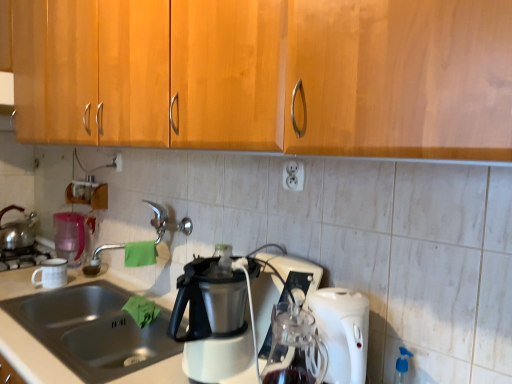
Question: Considering the relative sizes of shiny metallic kettle at left and white matte coffee cup at left in the image provided, is shiny metallic kettle at left smaller than white matte coffee cup at left?

Choices:
 (A) no
 (B) yes

Answer: (A)

Question: Does shiny metallic kettle at left have a greater width compared to white matte coffee cup at left?

Choices:
 (A) no
 (B) yes

Answer: (B)

Question: Is shiny metallic kettle at left thinner than white matte coffee cup at left?

Choices:
 (A) yes
 (B) no

Answer: (B)

Question: Is shiny metallic kettle at left located outside white matte coffee cup at left?

Choices:
 (A) yes
 (B) no

Answer: (A)

Question: Does shiny metallic kettle at left come in front of white matte coffee cup at left?

Choices:
 (A) yes
 (B) no

Answer: (B)

Question: Is blue translucent spray bottle at lower right wider or thinner than white plastic electric outlet at upper center, marked as the second electric outlet in a front-to-back arrangement?

Choices:
 (A) wide
 (B) thin

Answer: (A)

Question: Is blue translucent spray bottle at lower right taller or shorter than white plastic electric outlet at upper center, marked as the first electric outlet in a top-to-bottom arrangement?

Choices:
 (A) tall
 (B) short

Answer: (A)

Question: Relative to white plastic electric outlet at upper center, arranged as the 1th electric outlet when viewed from the back, is blue translucent spray bottle at lower right in front or behind?

Choices:
 (A) front
 (B) behind

Answer: (A)

Question: Is blue translucent spray bottle at lower right situated inside white plastic electric outlet at upper center, marked as the second electric outlet in a front-to-back arrangement, or outside?

Choices:
 (A) outside
 (B) inside

Answer: (A)

Question: Does point (292, 182) appear closer or farther from the camera than point (157, 230)?

Choices:
 (A) farther
 (B) closer

Answer: (B)

Question: From the image's perspective, is white plastic electric outlet at center, the 2th electric outlet positioned from the top, above or below satin nickel faucet at center?

Choices:
 (A) above
 (B) below

Answer: (A)

Question: Is white plastic electric outlet at center, positioned as the first electric outlet in right-to-left order, inside or outside of satin nickel faucet at center?

Choices:
 (A) outside
 (B) inside

Answer: (A)

Question: Is white plastic electric outlet at center, the 2th electric outlet in the back-to-front sequence, in front of or behind satin nickel faucet at center in the image?

Choices:
 (A) front
 (B) behind

Answer: (A)

Question: Is stainless steel sink at lower left spatially inside blue translucent spray bottle at lower right, or outside of it?

Choices:
 (A) inside
 (B) outside

Answer: (B)

Question: Looking at the image, does stainless steel sink at lower left seem bigger or smaller compared to blue translucent spray bottle at lower right?

Choices:
 (A) small
 (B) big

Answer: (B)